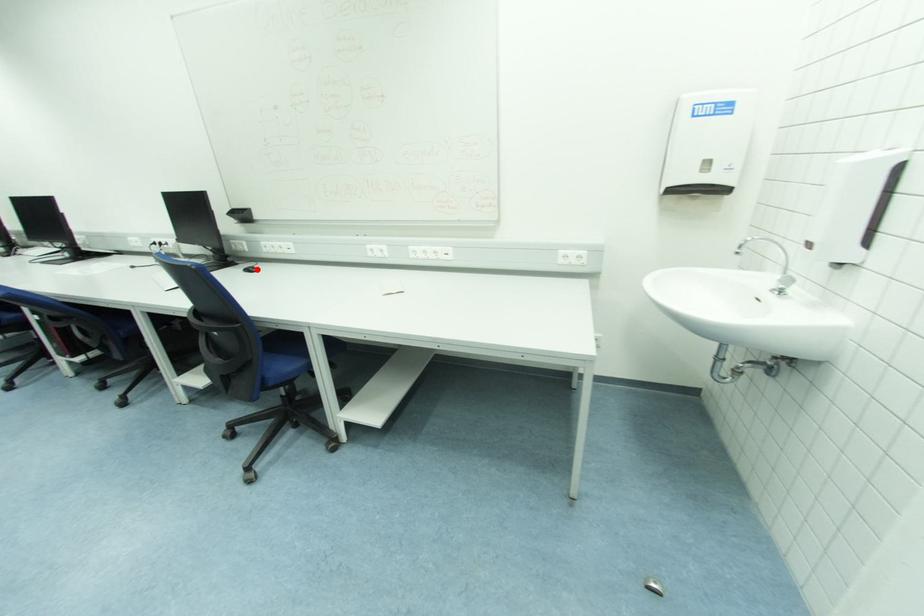
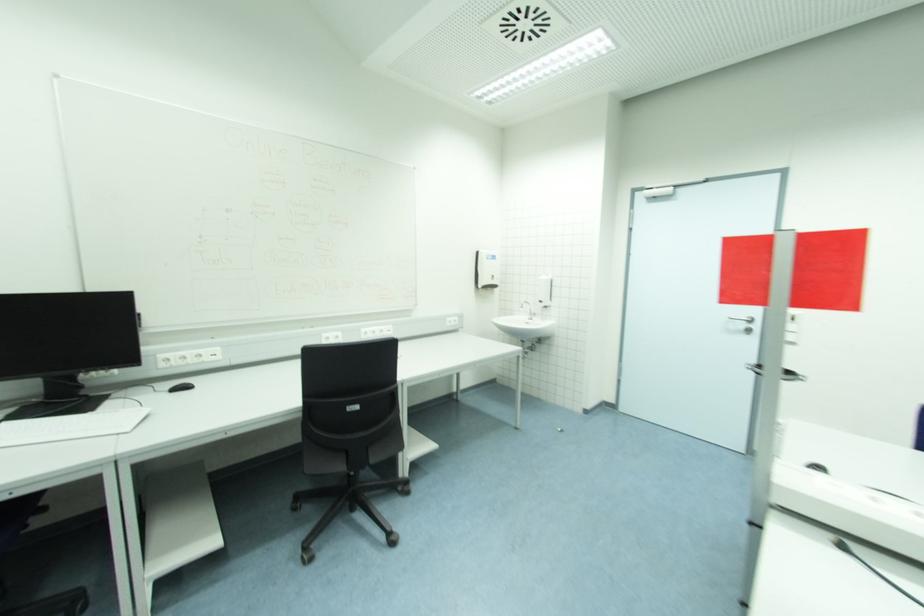
Locate, in the second image, the point that corresponds to the highlighted location in the first image.

(192, 386)